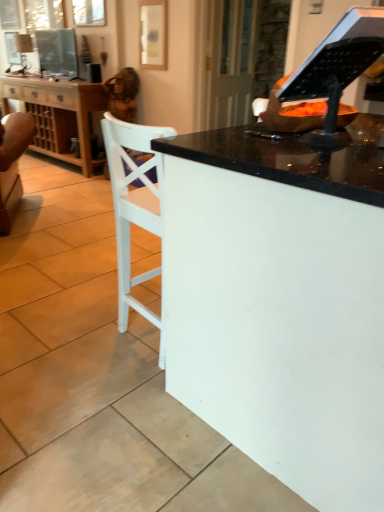
Question: Could transparent glass door at upper center be considered to be inside matte wooden picture frame at upper center?

Choices:
 (A) yes
 (B) no

Answer: (B)

Question: Is matte wooden picture frame at upper center oriented away from transparent glass door at upper center?

Choices:
 (A) no
 (B) yes

Answer: (A)

Question: Is matte wooden picture frame at upper center smaller than transparent glass door at upper center?

Choices:
 (A) no
 (B) yes

Answer: (B)

Question: Considering the relative sizes of matte wooden picture frame at upper center and transparent glass door at upper center in the image provided, is matte wooden picture frame at upper center wider than transparent glass door at upper center?

Choices:
 (A) yes
 (B) no

Answer: (B)

Question: From the image's perspective, does matte wooden picture frame at upper center appear higher than transparent glass door at upper center?

Choices:
 (A) no
 (B) yes

Answer: (B)

Question: Does matte wooden picture frame at upper center have a larger size compared to transparent glass door at upper center?

Choices:
 (A) no
 (B) yes

Answer: (A)

Question: Is white glossy desk at center outside of wooden cabinet at left?

Choices:
 (A) yes
 (B) no

Answer: (A)

Question: Considering the relative sizes of white glossy desk at center and wooden cabinet at left in the image provided, is white glossy desk at center taller than wooden cabinet at left?

Choices:
 (A) yes
 (B) no

Answer: (A)

Question: Is white glossy desk at center beside wooden cabinet at left?

Choices:
 (A) no
 (B) yes

Answer: (A)

Question: From the image's perspective, is white glossy desk at center above wooden cabinet at left?

Choices:
 (A) yes
 (B) no

Answer: (B)

Question: Is white glossy desk at center aimed at wooden cabinet at left?

Choices:
 (A) no
 (B) yes

Answer: (B)

Question: Is white glossy desk at center in front of wooden cabinet at left?

Choices:
 (A) no
 (B) yes

Answer: (B)

Question: Does white glossy desk at center appear on the right side of black plastic music stand at upper right?

Choices:
 (A) yes
 (B) no

Answer: (A)